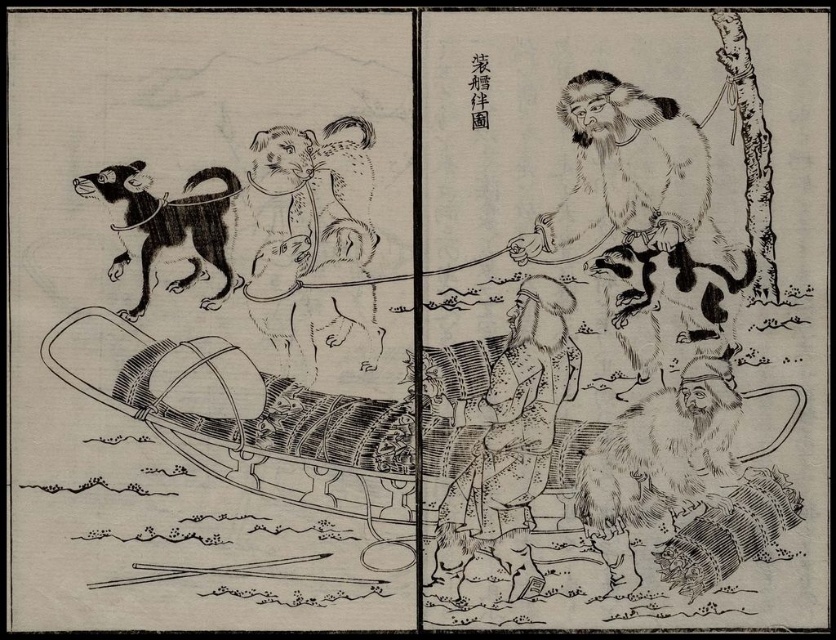
Based on the scene described, which animal has a greater width between the furry brown dog at lower right and the black fur cat at upper left?

The furry brown dog at lower right has a greater width than the black fur cat at upper left.

You are an observer looking at the black and white illustration. You notice the fur coat at center and the black fur cat at upper left. Which object is located closer to the top of the image?

The black fur cat at upper left is closer to the top of the image because it is positioned above the fur coat at center.

In the black and white illustration, there are two animals depicted as furry black dog at upper right and black fur cat at upper left. Based on their positions, which animal is located to the east if the image is oriented with the sled facing north?

The furry black dog at upper right is to the east of the black fur cat at upper left because in the image oriented with the sled facing north, the right side corresponds to the east direction.